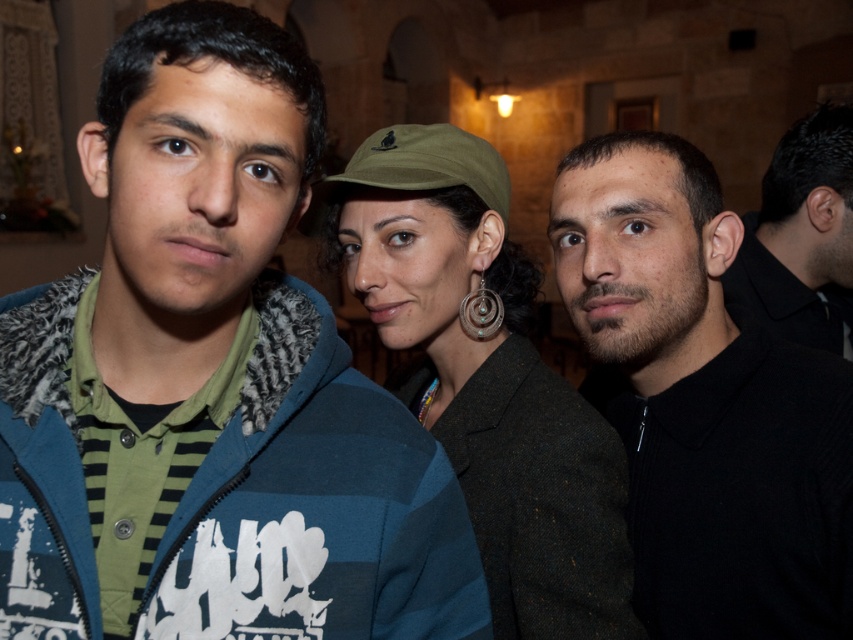
You are a photographer trying to adjust the lighting for a portrait. You notice the black matte shirt at center and the green fabric cap at center. Which object is closer to the camera?

The black matte shirt at center is positioned under the green fabric cap at center, meaning the green fabric cap at center is closer to the camera.

You are at a party and want to take a photo of the blue striped hoodie at center and the green fabric cap at center. Which one should you focus on first if you want to capture both in the frame?

The blue striped hoodie at center is positioned on the left side of green fabric cap at center, so you should focus on the blue striped hoodie at center first to ensure both are in the frame.

You are standing at the point with coordinates point [608,228] and want to move to the point with coordinates point [577,438]. Given that the path between them is clear, will you have to walk forward or backward to reach your destination?

Since point [608,228] is behind point [577,438], you will have to walk forward to reach point [577,438] from point [608,228].